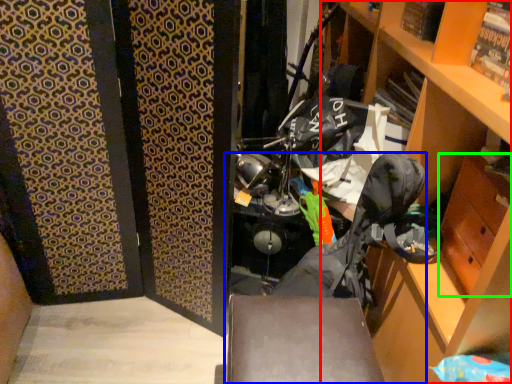
Question: Considering the real-world distances, which object is farthest from cabinetry (highlighted by a red box)? folding chair (highlighted by a blue box) or drawer (highlighted by a green box)?

Choices:
 (A) folding chair
 (B) drawer

Answer: (A)